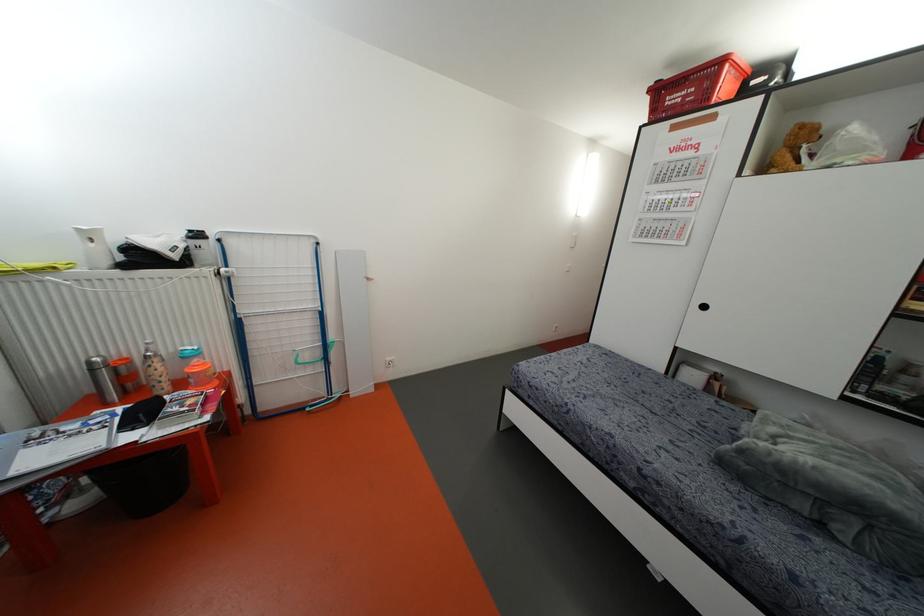
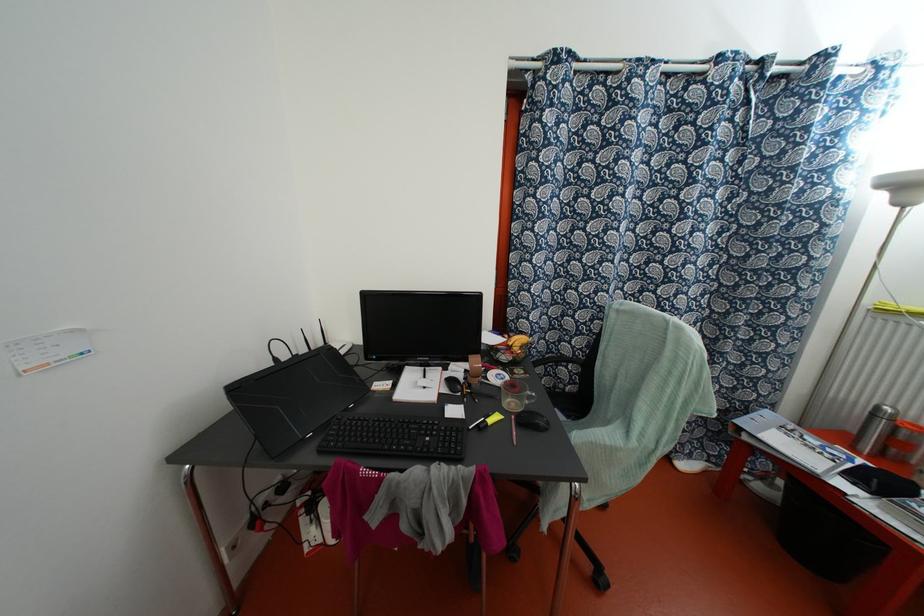
Where in the second image is the point corresponding to (x=91, y=370) from the first image?

(872, 415)